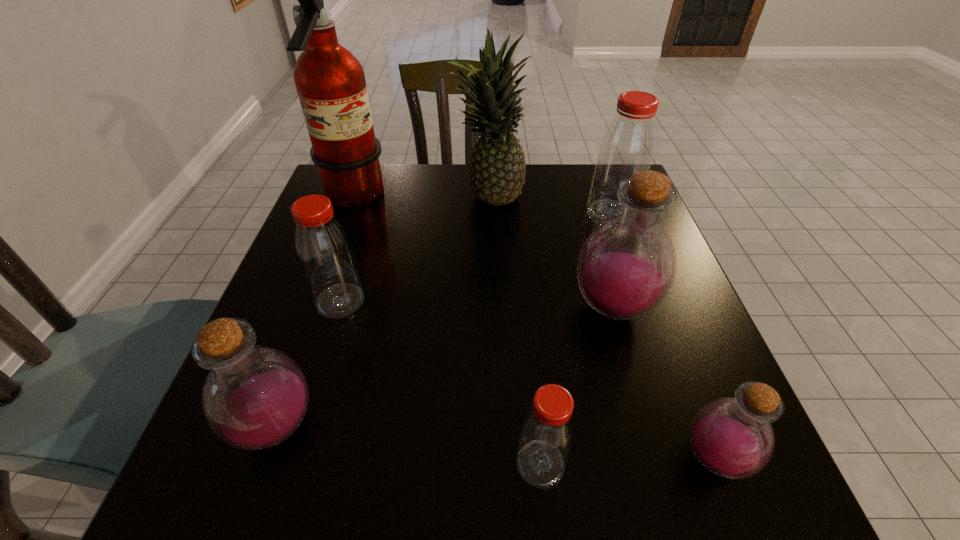
You are a GUI agent. You are given a task and a screenshot of the screen. Output one action in this format:
    pyautogui.click(x=<x>, y=<y>)
    Task: Click on the fire extinguisher
    Image resolution: width=960 pixels, height=540 pixels.
    Given the screenshot: What is the action you would take?
    pyautogui.click(x=330, y=81)

This screenshot has height=540, width=960. Find the location of `the seventh shortest object`. the seventh shortest object is located at coordinates (497, 172).

I want to click on green pineapple, so click(497, 172).

This screenshot has width=960, height=540. Identify the location of the biggest red bottle. (628, 144).

Where is `the rightmost red bottle`? the rightmost red bottle is located at coordinates (628, 144).

Locate an element on the screen. the farthest purple bottle is located at coordinates (626, 267).

Find the location of a particular element. the second nearest red bottle is located at coordinates (324, 251).

Locate an element on the screen. the second biggest red bottle is located at coordinates (324, 251).

At what (x,y) coordinates should I click in order to perform the action: click on the second biggest purple bottle. Please return your answer as a coordinate pair (x, y). The image size is (960, 540). Looking at the image, I should click on (255, 397).

I want to click on the smallest red bottle, so click(x=547, y=432).